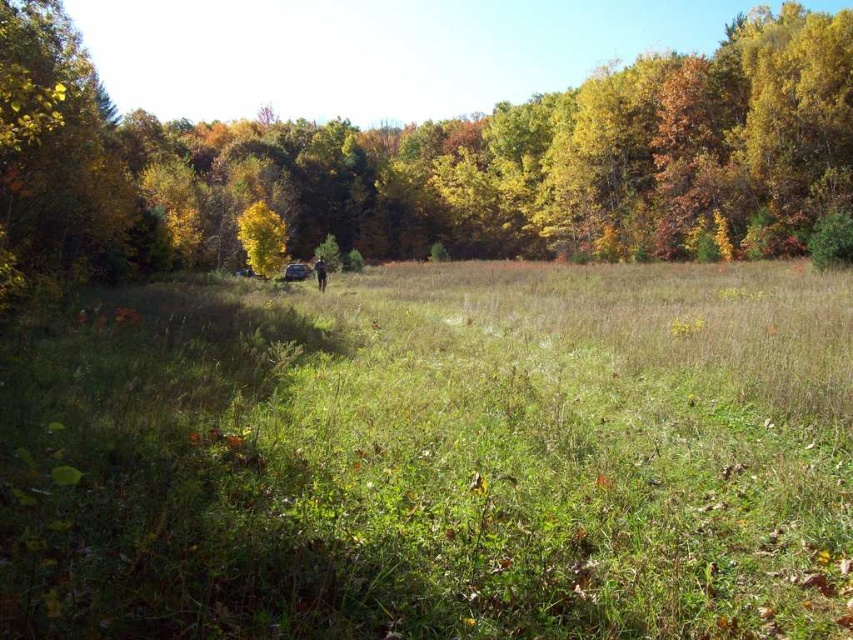
Does green leafy tree at center have a larger size compared to yellow leafy tree at center?

Yes.

Which is more to the left, green leafy tree at center or yellow leafy tree at center?

yellow leafy tree at center is more to the left.

Describe the element at coordinates (440, 161) in the screenshot. I see `green leafy tree at center` at that location.

This screenshot has width=853, height=640. What are the coordinates of `green leafy tree at center` in the screenshot? It's located at (440, 161).

Can you confirm if green grassy field at center is taller than green leafy tree at center?

No.

Based on the photo, is green grassy field at center smaller than green leafy tree at center?

Correct, green grassy field at center occupies less space than green leafy tree at center.

Identify the location of green grassy field at center. This screenshot has height=640, width=853. (434, 458).

Which is in front, point (727, 445) or point (258, 268)?

Point (727, 445) is more forward.

Is green grassy field at center thinner than yellow leafy tree at center?

Incorrect, green grassy field at center's width is not less than yellow leafy tree at center's.

Who is more distant from viewer, (x=154, y=458) or (x=262, y=202)?

Point (x=262, y=202)

At what (x,y) coordinates should I click in order to perform the action: click on green grassy field at center. Please return your answer as a coordinate pair (x, y). The image size is (853, 640). Looking at the image, I should click on (434, 458).